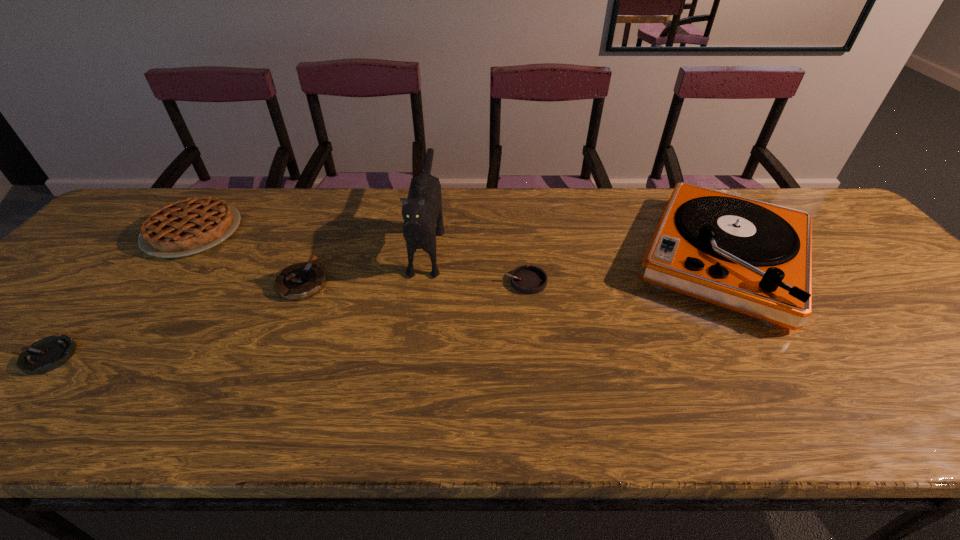
The width and height of the screenshot is (960, 540). Find the location of `the fourth object from left to right`. the fourth object from left to right is located at coordinates (422, 210).

The height and width of the screenshot is (540, 960). I want to click on the tallest object, so click(422, 210).

Identify the location of the fifth shortest object. The width and height of the screenshot is (960, 540). (753, 257).

This screenshot has width=960, height=540. Find the location of `record player`. record player is located at coordinates (753, 257).

I want to click on the third tallest object, so click(x=189, y=226).

I want to click on the second ashtray from right to left, so click(x=303, y=280).

Find the location of a particular element. the third object from left to right is located at coordinates (303, 280).

Where is `the rightmost ashtray`? the rightmost ashtray is located at coordinates (525, 279).

Find the location of a particular element. The width and height of the screenshot is (960, 540). the second shortest object is located at coordinates (525, 279).

Where is `the shortest ashtray`? the shortest ashtray is located at coordinates (45, 355).